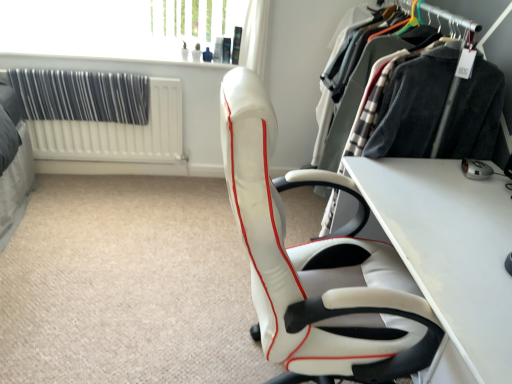
Find the location of a particular element. empty space that is ontop of black fabric curtain at upper left (from a real-world perspective) is located at coordinates [x=77, y=68].